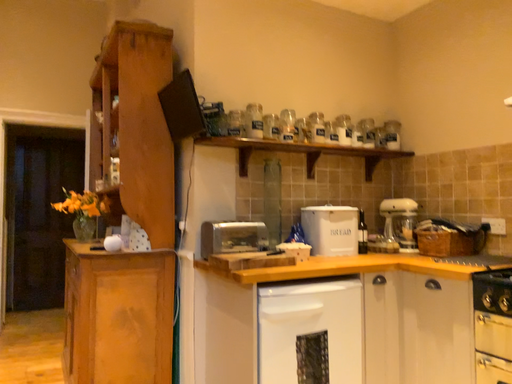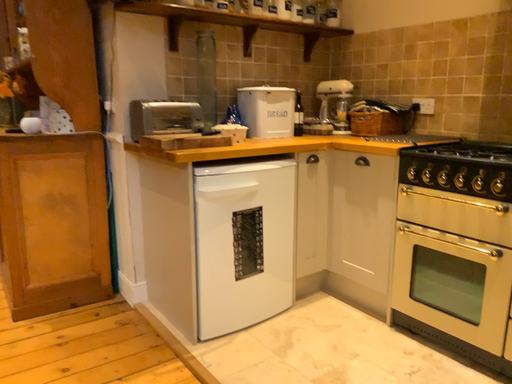
Question: Which way did the camera rotate in the video?

Choices:
 (A) rotated right
 (B) rotated left

Answer: (A)